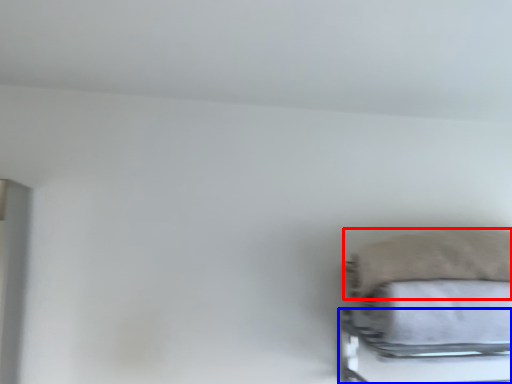
Question: Which object is further to the camera taking this photo, pillow (highlighted by a red box) or bed frame (highlighted by a blue box)?

Choices:
 (A) pillow
 (B) bed frame

Answer: (A)